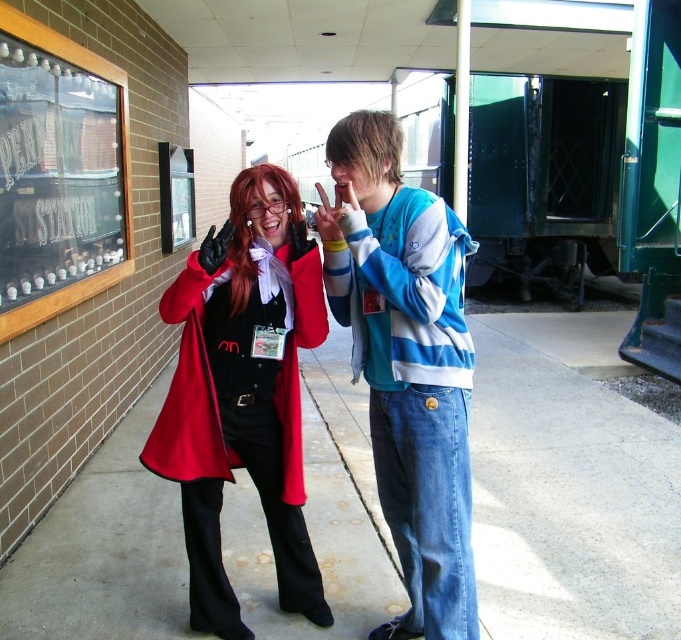
Question: Which of the following is the closest to the observer?

Choices:
 (A) (409, 413)
 (B) (125, 262)

Answer: (A)

Question: Which point is farther from the camera taking this photo?

Choices:
 (A) (27, 538)
 (B) (95, 58)

Answer: (B)

Question: Where is smooth concrete pavement at center located in relation to matte red coat at center in the image?

Choices:
 (A) right
 (B) left

Answer: (A)

Question: Which object appears closest to the camera in this image?

Choices:
 (A) blue striped hoodie at center
 (B) wooden frame signboard at upper left
 (C) matte red coat at center

Answer: (C)

Question: Can you confirm if blue striped hoodie at center is smaller than matte red coat at center?

Choices:
 (A) no
 (B) yes

Answer: (B)

Question: Does blue striped hoodie at center have a lesser width compared to matte red coat at center?

Choices:
 (A) yes
 (B) no

Answer: (A)